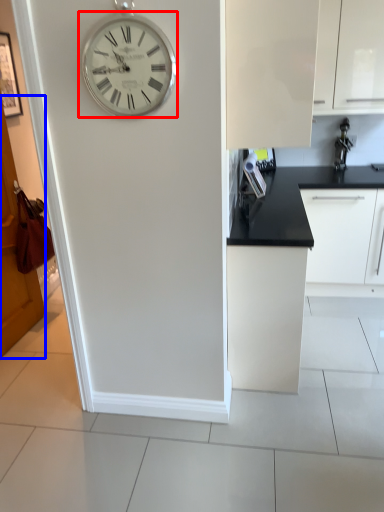
Question: Among these objects, which one is farthest to the camera, wall clock (highlighted by a red box) or door (highlighted by a blue box)?

Choices:
 (A) wall clock
 (B) door

Answer: (B)